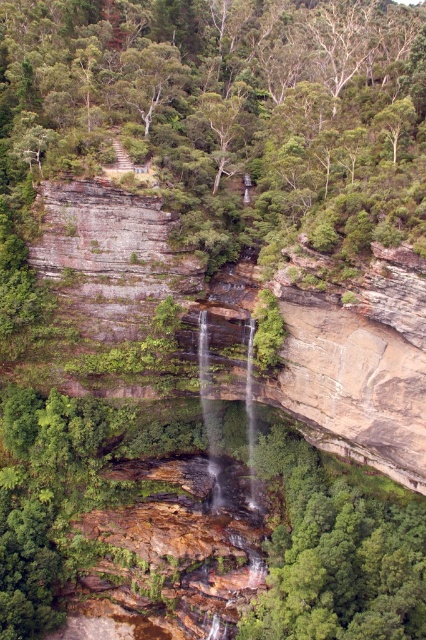
Between point (333, 177) and point (166, 288), which one is positioned behind?

The point (166, 288) is more distant.

Is green leafy tree at center smaller than brown rough cliff at center?

No, green leafy tree at center is not smaller than brown rough cliff at center.

Describe the element at coordinates (224, 115) in the screenshot. I see `green leafy tree at center` at that location.

The width and height of the screenshot is (426, 640). Identify the location of green leafy tree at center. (224, 115).